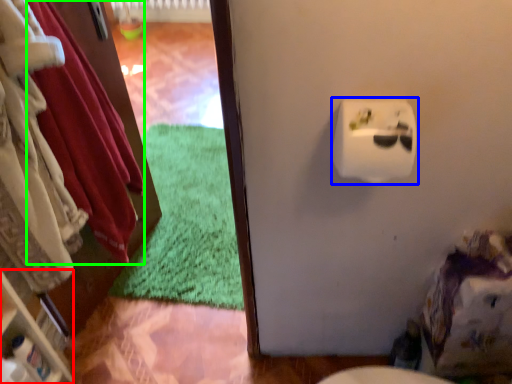
Question: Which object is the closest to the shelf (highlighted by a red box)? Choose among these: toilet paper (highlighted by a blue box) or clothing (highlighted by a green box).

Choices:
 (A) toilet paper
 (B) clothing

Answer: (B)